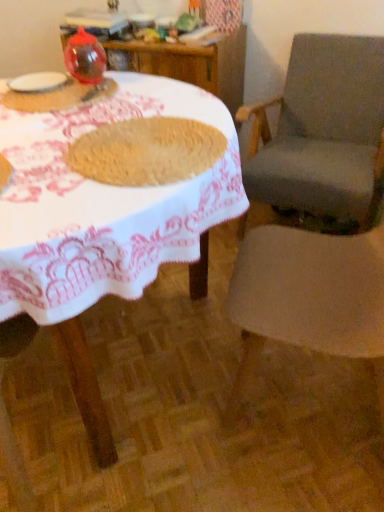
Identify the location of vacant region to the right of translucent plastic cup at upper left, which appears as the first tableware when ordered from the bottom. (148, 101).